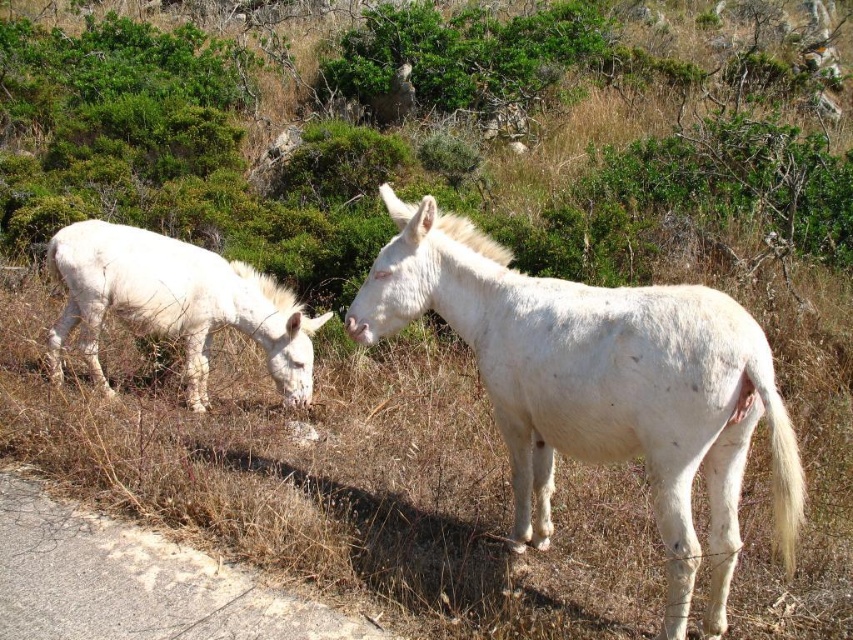
Between white matte donkey at center and white matte donkey at left, which one is positioned lower?

white matte donkey at center

Does white matte donkey at center have a greater height compared to white matte donkey at left?

Yes.

This screenshot has height=640, width=853. In order to click on white matte donkey at center in this screenshot , I will do `click(601, 387)`.